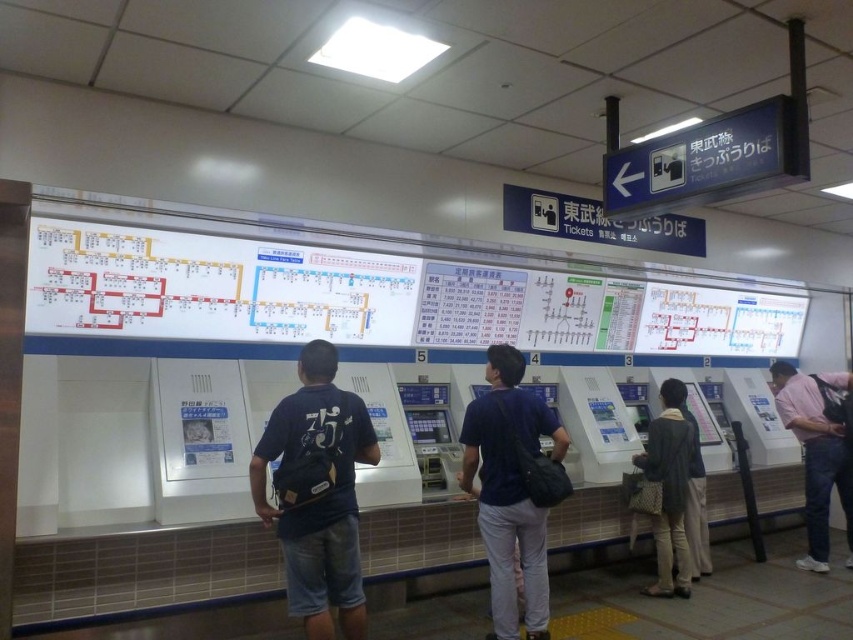
Question: From the image, what is the correct spatial relationship of dark blue backpack at center in relation to pink cotton shirt at right?

Choices:
 (A) right
 (B) left

Answer: (B)

Question: Estimate the real-world distances between objects in this image. Which object is farther from the beige fabric jacket at center?

Choices:
 (A) dark blue shirt at center
 (B) dark blue backpack at center
 (C) pink cotton shirt at right

Answer: (B)

Question: Does dark blue backpack at center appear on the right side of beige fabric jacket at center?

Choices:
 (A) no
 (B) yes

Answer: (A)

Question: Which object is closer to the camera taking this photo?

Choices:
 (A) pink cotton shirt at right
 (B) dark blue shirt at center

Answer: (B)

Question: Among these points, which one is farthest from the camera?

Choices:
 (A) (258, 480)
 (B) (666, 531)

Answer: (B)

Question: Is pink cotton shirt at right thinner than beige fabric jacket at center?

Choices:
 (A) no
 (B) yes

Answer: (A)